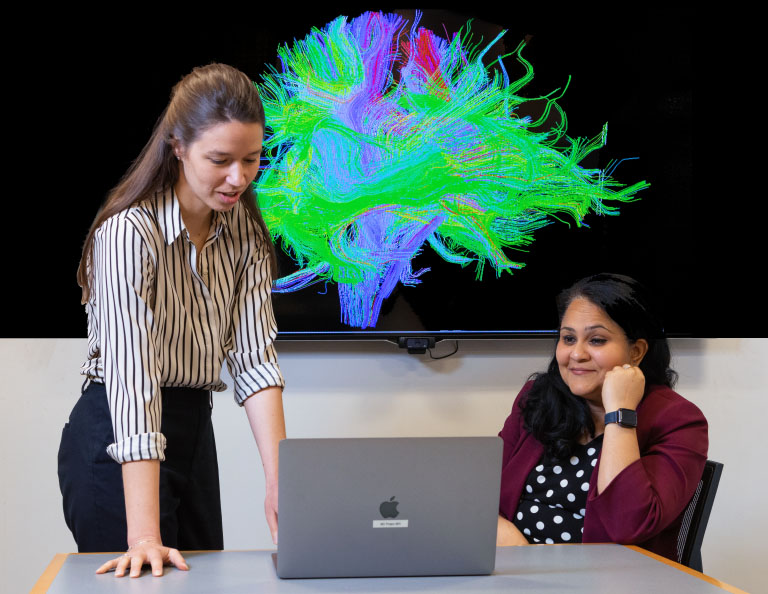
Where is `grey table with oak trim`? grey table with oak trim is located at coordinates (240, 574).